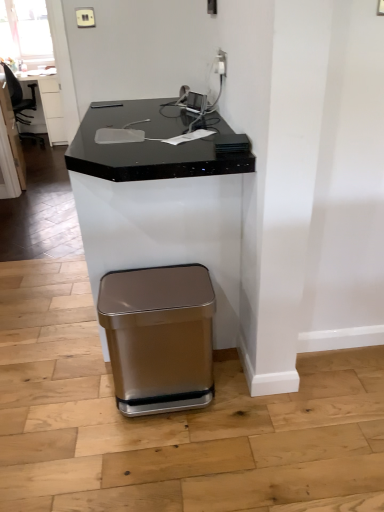
Question: Is black granite table at upper left at the back of satin gold trash can at lower center?

Choices:
 (A) yes
 (B) no

Answer: (B)

Question: From the image's perspective, is satin gold trash can at lower center above black granite table at upper left?

Choices:
 (A) yes
 (B) no

Answer: (B)

Question: Is satin gold trash can at lower center not close to black granite table at upper left?

Choices:
 (A) no
 (B) yes

Answer: (B)

Question: Is the depth of satin gold trash can at lower center less than that of black granite table at upper left?

Choices:
 (A) no
 (B) yes

Answer: (B)

Question: Considering the relative sizes of satin gold trash can at lower center and black granite table at upper left in the image provided, is satin gold trash can at lower center taller than black granite table at upper left?

Choices:
 (A) no
 (B) yes

Answer: (A)

Question: Considering the relative sizes of satin gold trash can at lower center and black granite table at upper left in the image provided, is satin gold trash can at lower center shorter than black granite table at upper left?

Choices:
 (A) yes
 (B) no

Answer: (A)

Question: Is black leather swivel chair at left in contact with black granite table at upper left?

Choices:
 (A) yes
 (B) no

Answer: (B)

Question: Is black leather swivel chair at left bigger than black granite table at upper left?

Choices:
 (A) yes
 (B) no

Answer: (B)

Question: Considering the relative sizes of black leather swivel chair at left and black granite table at upper left in the image provided, is black leather swivel chair at left taller than black granite table at upper left?

Choices:
 (A) yes
 (B) no

Answer: (A)

Question: Is black leather swivel chair at left wider than black granite table at upper left?

Choices:
 (A) no
 (B) yes

Answer: (A)

Question: Is black leather swivel chair at left facing away from black granite table at upper left?

Choices:
 (A) no
 (B) yes

Answer: (A)

Question: From a real-world perspective, is black leather swivel chair at left below black granite table at upper left?

Choices:
 (A) no
 (B) yes

Answer: (A)

Question: From the image's perspective, would you say satin gold outlet at upper center is shown under satin gold trash can at lower center?

Choices:
 (A) yes
 (B) no

Answer: (B)